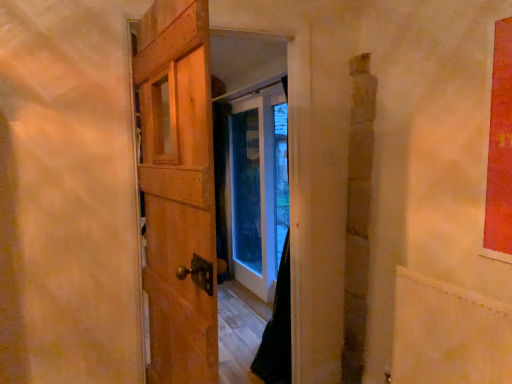
What is the approximate height of smooth beige plywood at lower right?

smooth beige plywood at lower right is 24.59 inches tall.

What do you see at coordinates (448, 334) in the screenshot? Image resolution: width=512 pixels, height=384 pixels. I see `smooth beige plywood at lower right` at bounding box center [448, 334].

Where is `smooth beige plywood at lower right`? smooth beige plywood at lower right is located at coordinates coord(448,334).

At what (x,y) coordinates should I click in order to perform the action: click on wooden door at center. Please return your answer as a coordinate pair (x, y). Image resolution: width=512 pixels, height=384 pixels. Looking at the image, I should click on (178, 191).

Describe the element at coordinates (178, 191) in the screenshot. The width and height of the screenshot is (512, 384). I see `wooden door at center` at that location.

At what (x,y) coordinates should I click in order to perform the action: click on smooth beige plywood at lower right. Please return your answer as a coordinate pair (x, y). This screenshot has width=512, height=384. Looking at the image, I should click on (448, 334).

Considering the relative positions of wooden door at center and smooth beige plywood at lower right in the image provided, is wooden door at center to the right of smooth beige plywood at lower right from the viewer's perspective?

Incorrect, wooden door at center is not on the right side of smooth beige plywood at lower right.

Is the position of wooden door at center more distant than that of smooth beige plywood at lower right?

No, wooden door at center is closer to the viewer.

Considering the positions of point (180, 148) and point (456, 310), is point (180, 148) closer or farther from the camera than point (456, 310)?

Point (180, 148) is closer to the camera than point (456, 310).

From the image's perspective, who appears lower, wooden door at center or smooth beige plywood at lower right?

smooth beige plywood at lower right.

From a real-world perspective, between wooden door at center and smooth beige plywood at lower right, who is vertically lower?

smooth beige plywood at lower right.

Considering the sizes of wooden door at center and smooth beige plywood at lower right in the image, is wooden door at center wider or thinner than smooth beige plywood at lower right?

wooden door at center is wider than smooth beige plywood at lower right.

Considering the relative sizes of wooden door at center and smooth beige plywood at lower right in the image provided, is wooden door at center taller than smooth beige plywood at lower right?

Indeed, wooden door at center has a greater height compared to smooth beige plywood at lower right.

Between wooden door at center and smooth beige plywood at lower right, which one has larger size?

wooden door at center.

Is smooth beige plywood at lower right surrounded by wooden door at center?

No, wooden door at center does not contain smooth beige plywood at lower right.

Is wooden door at center beside smooth beige plywood at lower right?

No, wooden door at center is not making contact with smooth beige plywood at lower right.

Is wooden door at center facing away from smooth beige plywood at lower right?

Yes, wooden door at center's orientation is away from smooth beige plywood at lower right.

What's the angular difference between wooden door at center and smooth beige plywood at lower right's facing directions?

There is a 8.1-degree angle between the facing directions of wooden door at center and smooth beige plywood at lower right.

Measure the distance between wooden door at center and smooth beige plywood at lower right.

The distance of wooden door at center from smooth beige plywood at lower right is 3.48 feet.

You are a GUI agent. You are given a task and a screenshot of the screen. Output one action in this format:
    pyautogui.click(x=<x>, y=<y>)
    Task: Click on the plywood below the wooden door at center (from a real-world perspective)
    The height and width of the screenshot is (384, 512).
    Given the screenshot: What is the action you would take?
    pyautogui.click(x=448, y=334)

Between smooth beige plywood at lower right and wooden door at center, which one appears on the right side from the viewer's perspective?

Positioned to the right is smooth beige plywood at lower right.

Which object is closer to the camera, smooth beige plywood at lower right or wooden door at center?

Positioned in front is wooden door at center.

Which point is more distant from viewer, (430, 346) or (150, 272)?

The point (150, 272) is more distant.

From the image's perspective, between smooth beige plywood at lower right and wooden door at center, who is located below?

From the image's view, smooth beige plywood at lower right is below.

From a real-world perspective, who is located higher, smooth beige plywood at lower right or wooden door at center?

wooden door at center.

Considering the sizes of objects smooth beige plywood at lower right and wooden door at center in the image provided, who is wider, smooth beige plywood at lower right or wooden door at center?

wooden door at center.

Which of these two, smooth beige plywood at lower right or wooden door at center, stands shorter?

Standing shorter between the two is smooth beige plywood at lower right.

Based on the photo, considering the sizes of smooth beige plywood at lower right and wooden door at center in the image, is smooth beige plywood at lower right bigger or smaller than wooden door at center?

Considering their sizes, smooth beige plywood at lower right takes up less space than wooden door at center.

Would you say wooden door at center is part of smooth beige plywood at lower right's contents?

No, smooth beige plywood at lower right does not contain wooden door at center.

Is smooth beige plywood at lower right not close to wooden door at center?

That's right, there is a large distance between smooth beige plywood at lower right and wooden door at center.

Does smooth beige plywood at lower right turn towards wooden door at center?

Yes, smooth beige plywood at lower right is turned towards wooden door at center.

What's the angular difference between smooth beige plywood at lower right and wooden door at center's facing directions?

The angle between the facing direction of smooth beige plywood at lower right and the facing direction of wooden door at center is 8.1 degrees.

Locate an element on the screen. The width and height of the screenshot is (512, 384). door located in front of the smooth beige plywood at lower right is located at coordinates (178, 191).

Identify the location of plywood behind the wooden door at center. (448, 334).

Image resolution: width=512 pixels, height=384 pixels. I want to click on plywood lying on the right of wooden door at center, so click(x=448, y=334).